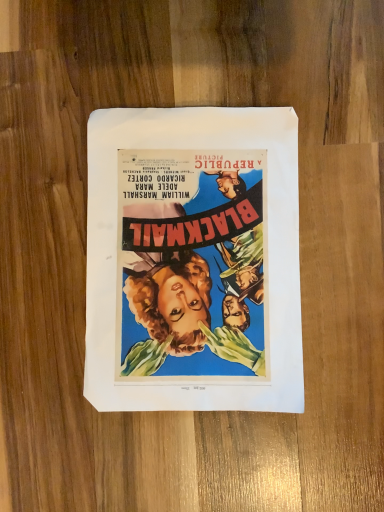
At what (x,y) coordinates should I click in order to perform the action: click on empty space that is ontop of vibrant paper poster at center (from a real-world perspective). Please return your answer as a coordinate pair (x, y). The image size is (384, 512). Looking at the image, I should click on (188, 258).